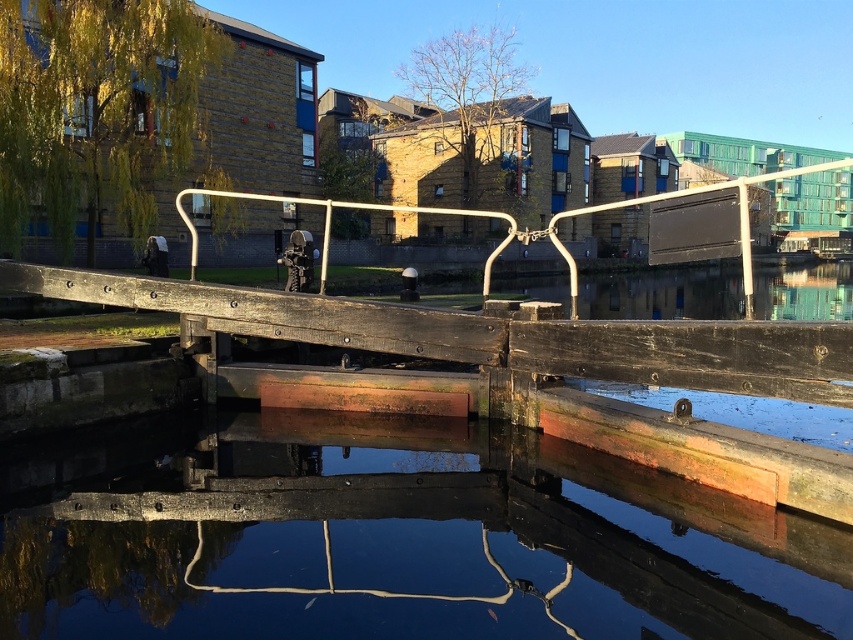
Is smooth concrete water at center to the left of white metal rail at center from the viewer's perspective?

Indeed, smooth concrete water at center is positioned on the left side of white metal rail at center.

Which is more to the left, smooth concrete water at center or white metal rail at center?

smooth concrete water at center

Measure the distance between smooth concrete water at center and camera.

→ smooth concrete water at center is 4.28 meters away from camera.

Find the location of a particular element. Image resolution: width=853 pixels, height=640 pixels. smooth concrete water at center is located at coordinates (393, 541).